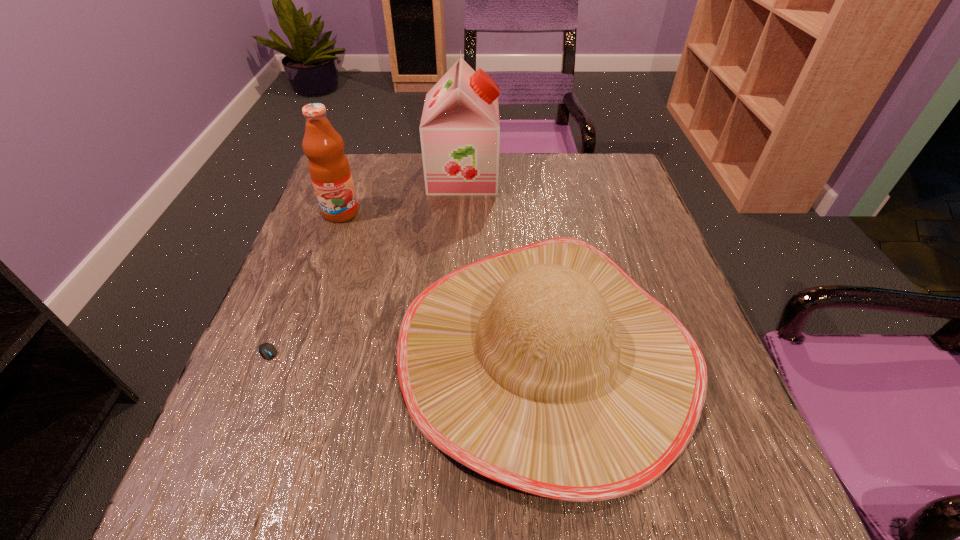
Identify the location of soya milk. The width and height of the screenshot is (960, 540). (460, 129).

Where is `the second farthest object`? the second farthest object is located at coordinates (329, 169).

Locate an element on the screen. Image resolution: width=960 pixels, height=540 pixels. the second shortest object is located at coordinates (547, 368).

The height and width of the screenshot is (540, 960). Identify the location of the shortest object. (266, 350).

Image resolution: width=960 pixels, height=540 pixels. What are the coordinates of `free space located with the cap open on the farthest object` in the screenshot? It's located at (578, 176).

I want to click on free region located 0.270m on the front label of the second farthest object, so click(305, 310).

I want to click on blank space located 0.230m on the left of the second shortest object, so click(x=271, y=352).

Find the location of a particular element. Image resolution: width=960 pixels, height=540 pixels. vacant space situated on the back of the shortest object is located at coordinates (320, 244).

At what (x,y) coordinates should I click in order to perform the action: click on soya milk located in the far edge section of the desktop. Please return your answer as a coordinate pair (x, y). This screenshot has height=540, width=960. Looking at the image, I should click on (460, 129).

Locate an element on the screen. This screenshot has width=960, height=540. fruit juice at the far edge is located at coordinates (329, 169).